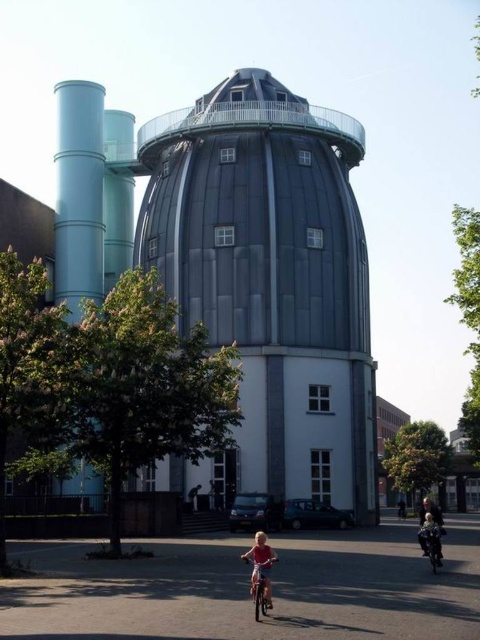
Question: Which object is positioned closest to the light blue fabric jacket at lower right?

Choices:
 (A) metallic gray observatory at center
 (B) matte pink shirt at lower center

Answer: (B)

Question: Does metallic gray observatory at center appear over matte pink shirt at lower center?

Choices:
 (A) no
 (B) yes

Answer: (B)

Question: Which object is the closest to the metallic gray observatory at center?

Choices:
 (A) matte pink shirt at lower center
 (B) light blue fabric jacket at lower right

Answer: (A)

Question: Considering the real-world distances, which object is farthest from the metallic gray observatory at center?

Choices:
 (A) matte pink shirt at lower center
 (B) light blue fabric jacket at lower right

Answer: (B)

Question: From the image, what is the correct spatial relationship of matte pink shirt at lower center in relation to light blue fabric jacket at lower right?

Choices:
 (A) below
 (B) above

Answer: (B)

Question: Does metallic gray observatory at center appear on the right side of matte pink shirt at lower center?

Choices:
 (A) yes
 (B) no

Answer: (B)